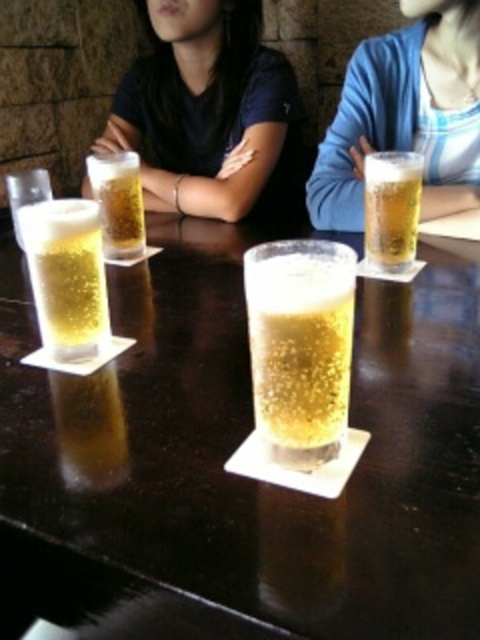
You are a server who needs to place a 12 inch long menu between the two translucent glass beer at right and the translucent glass beer at center. Can you fit the menu between them without moving the glasses?

The distance between the translucent glass beer at right and the translucent glass beer at center is 13.67 inches. Since the menu is 12 inches long, it will fit between them as there is enough space.

You are at a bar and want to order a drink. The bartender points to a location on the table using coordinates. The coordinates given are point (245, 435). According to the scene description, what is located at this point?

The point (245, 435) marks the clear glass beer at center.

You are a bartender standing behind the bar. You need to place a new drink order for the customer whose clear glass beer at center is in front of them. The minimum distance required for a drink to be placed safely is 35 centimeters from the viewer. Can you place the new drink here?

The clear glass beer at center is 37.62 centimeters away from the viewer, which exceeds the minimum distance requirement of 35 centimeters. Therefore, you can safely place the new drink here.